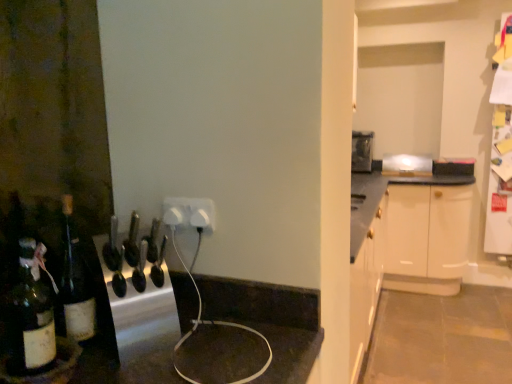
Question: Can you confirm if dark brown glass bottle at lower left is positioned to the right of white plastic outlet at center?

Choices:
 (A) no
 (B) yes

Answer: (A)

Question: Is dark brown glass bottle at lower left oriented away from white plastic outlet at center?

Choices:
 (A) yes
 (B) no

Answer: (B)

Question: Is dark brown glass bottle at lower left thinner than white plastic outlet at center?

Choices:
 (A) yes
 (B) no

Answer: (B)

Question: From the image's perspective, is dark brown glass bottle at lower left located beneath white plastic outlet at center?

Choices:
 (A) yes
 (B) no

Answer: (A)

Question: Is dark brown glass bottle at lower left facing towards white plastic outlet at center?

Choices:
 (A) no
 (B) yes

Answer: (A)

Question: In terms of size, does metallic silver toaster at upper center, which is the 2th appliance in front-to-back order, appear bigger or smaller than translucent glass bottle at left?

Choices:
 (A) small
 (B) big

Answer: (B)

Question: Is metallic silver toaster at upper center, placed as the first appliance when sorted from right to left, taller or shorter than translucent glass bottle at left?

Choices:
 (A) tall
 (B) short

Answer: (A)

Question: From a real-world perspective, relative to translucent glass bottle at left, is metallic silver toaster at upper center, which is the 2th appliance in front-to-back order, vertically above or below?

Choices:
 (A) above
 (B) below

Answer: (A)

Question: Does point (362, 152) appear closer or farther from the camera than point (66, 281)?

Choices:
 (A) closer
 (B) farther

Answer: (B)

Question: Would you say metallic silver knife block at center, acting as the second appliance starting from the right, is inside or outside white plastic outlet at center?

Choices:
 (A) outside
 (B) inside

Answer: (A)

Question: From a real-world perspective, relative to white plastic outlet at center, is metallic silver knife block at center, which is the second appliance from back to front, vertically above or below?

Choices:
 (A) below
 (B) above

Answer: (A)

Question: Considering the relative positions of metallic silver knife block at center, which is counted as the first appliance, starting from the front, and white plastic outlet at center in the image provided, is metallic silver knife block at center, which is counted as the first appliance, starting from the front, to the left or to the right of white plastic outlet at center?

Choices:
 (A) left
 (B) right

Answer: (A)

Question: From the image's perspective, relative to white plastic outlet at center, is metallic silver knife block at center, the first appliance in the left-to-right sequence, above or below?

Choices:
 (A) below
 (B) above

Answer: (A)

Question: Considering the positions of point (197, 223) and point (138, 296), is point (197, 223) closer or farther from the camera than point (138, 296)?

Choices:
 (A) closer
 (B) farther

Answer: (B)

Question: Based on their sizes in the image, would you say white plastic outlet at center is bigger or smaller than metallic silver knife block at center, which is counted as the first appliance, starting from the front?

Choices:
 (A) big
 (B) small

Answer: (B)